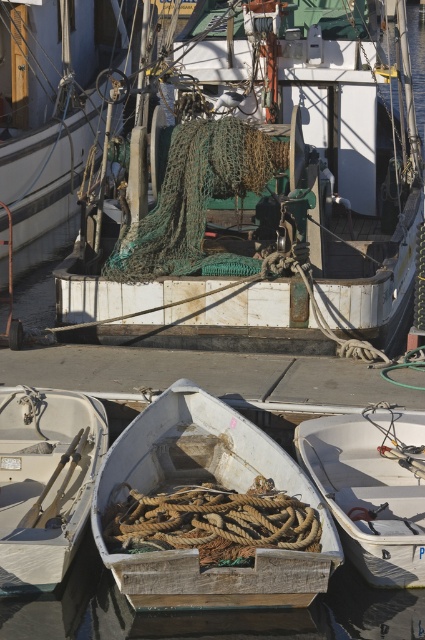
Measure the distance from green netting at center to white matte boat at lower center.

A distance of 52.72 feet exists between green netting at center and white matte boat at lower center.

Is point (53, 6) in front of point (393, 416)?

No, (53, 6) is behind (393, 416).

Locate an element on the screen. The height and width of the screenshot is (640, 425). green netting at center is located at coordinates (51, 102).

Between point (113, 253) and point (61, 170), which one is positioned in front?

Positioned in front is point (113, 253).

Does point (167, 275) come closer to viewer compared to point (22, 99)?

Yes, it is in front of point (22, 99).

The image size is (425, 640). Identify the location of rusty metal boat at center. (345, 180).

Can you confirm if rusty metal boat at center is shorter than white matte boat at lower left?

Indeed, rusty metal boat at center has a lesser height compared to white matte boat at lower left.

Between point (388, 323) and point (90, 420), which one is positioned behind?

The point (388, 323) is behind.

Locate an element on the screen. rusty metal boat at center is located at coordinates (345, 180).